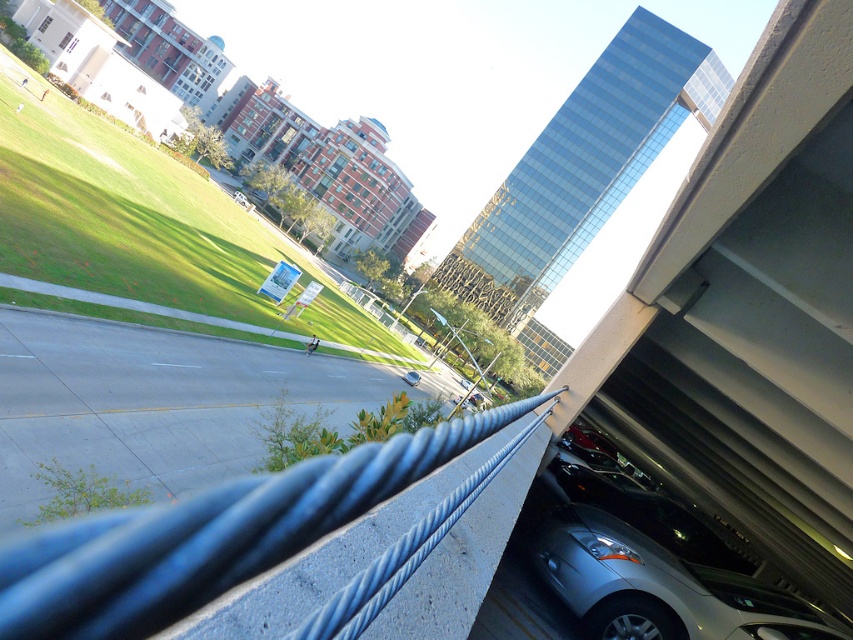
You are a delivery drone operator. Your drone has a wingspan of 0.8 meters and needs to navigate between the blue rubber highway at lower left and the blue metallic rail at center. Can the drone safely pass through the space between them?

The blue rubber highway at lower left is thinner than the blue metallic rail at center, so the space between them is narrower than the rail. Since the drone has a wingspan of 0.8 meters, it depends on the actual width of the space. However, since the highway is thinner, the gap might be too narrow for the drone. Without exact measurements, it is not safe to assume it can pass.

You are a delivery drone operator. Your drone needs to land on the blue rubber highway at lower left and then move to the blue metallic rail at center. Considering their sizes, which location requires more careful maneuvering?

The blue metallic rail at center requires more careful maneuvering because it has a smaller size compared to the blue rubber highway at lower left, making it harder to land precisely.

You are standing on the balcony and want to take a photo of both the point at coordinates point (241, 362) and the point at coordinates point (320, 486). Which point will appear closer to the camera in your photo?

Point (241, 362) is further to the camera than point (320, 486), so the point at coordinates point (320, 486) will appear closer to the camera in the photo.